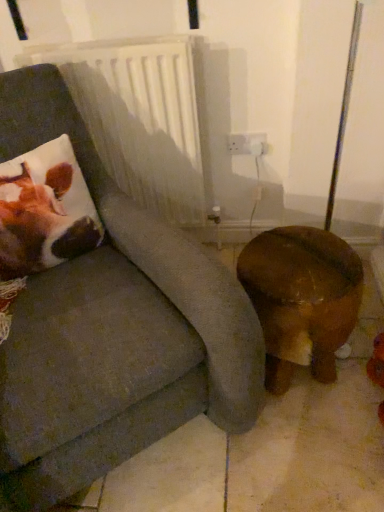
What do you see at coordinates (301, 298) in the screenshot? I see `brown wooden stool at lower right` at bounding box center [301, 298].

The image size is (384, 512). What are the coordinates of `brown wooden stool at lower right` in the screenshot? It's located at (301, 298).

Measure the distance between brown plush cushion at left and camera.

brown plush cushion at left and camera are 3.86 feet apart.

Describe the element at coordinates (113, 329) in the screenshot. I see `suede-like gray chair at left` at that location.

The image size is (384, 512). Identify the location of brown wooden stool at lower right. (301, 298).

Looking at this image, does white plastic radiator at upper center appear on the right side of brown wooden stool at lower right?

No.

Is white plastic radiator at upper center placed right next to brown wooden stool at lower right?

white plastic radiator at upper center is not next to brown wooden stool at lower right, and they're not touching.

Would you say white plastic radiator at upper center contains brown wooden stool at lower right?

No.

From a real-world perspective, relative to brown plush cushion at left, is white plastic radiator at upper center vertically above or below?

Clearly, from a real-world perspective, white plastic radiator at upper center is below brown plush cushion at left.

Considering the positions of points (162, 96) and (20, 176), is point (162, 96) closer to camera compared to point (20, 176)?

That is False.

How distant is white plastic radiator at upper center from brown plush cushion at left?

16.01 inches.

Does white plastic radiator at upper center have a larger size compared to brown plush cushion at left?

Yes, white plastic radiator at upper center is bigger than brown plush cushion at left.

Does brown plush cushion at left have a smaller size compared to suede-like gray chair at left?

Indeed, brown plush cushion at left has a smaller size compared to suede-like gray chair at left.

From a real-world perspective, is brown plush cushion at left located beneath suede-like gray chair at left?

No, from a real-world perspective, brown plush cushion at left is not beneath suede-like gray chair at left.

Between brown plush cushion at left and suede-like gray chair at left, which one has smaller width?

Thinner between the two is brown plush cushion at left.

Consider the image. Which is more to the left, brown plush cushion at left or suede-like gray chair at left?

Positioned to the left is brown plush cushion at left.

Is suede-like gray chair at left smaller than brown plush cushion at left?

No.

How far apart are suede-like gray chair at left and brown plush cushion at left?

suede-like gray chair at left is 9.91 inches from brown plush cushion at left.

Is brown plush cushion at left a part of suede-like gray chair at left?

Yes, suede-like gray chair at left is surrounding brown plush cushion at left.

Based on the photo, is brown plush cushion at left shorter than white plastic radiator at upper center?

Correct, brown plush cushion at left is not as tall as white plastic radiator at upper center.

Which is in front, point (68, 163) or point (168, 105)?

The point (68, 163) is closer to the camera.

Is brown plush cushion at left facing away from white plastic radiator at upper center?

No, brown plush cushion at left is not facing away from white plastic radiator at upper center.

Looking at this image, would you consider brown plush cushion at left to be distant from white plastic radiator at upper center?

No, brown plush cushion at left is not far from white plastic radiator at upper center.

From the picture: From the image's perspective, between white plastic radiator at upper center and suede-like gray chair at left, who is located below?

From the image's view, suede-like gray chair at left is below.

Is white plastic radiator at upper center surrounding suede-like gray chair at left?

No, suede-like gray chair at left is not inside white plastic radiator at upper center.

The width and height of the screenshot is (384, 512). Find the location of `chair on the left of white plastic radiator at upper center`. chair on the left of white plastic radiator at upper center is located at coordinates (113, 329).

Would you say suede-like gray chair at left is part of brown wooden stool at lower right's contents?

No, suede-like gray chair at left is not surrounded by brown wooden stool at lower right.

Which of these two, brown wooden stool at lower right or suede-like gray chair at left, is thinner?

brown wooden stool at lower right is thinner.

Based on the photo, is brown wooden stool at lower right looking in the opposite direction of suede-like gray chair at left?

That's not correct — brown wooden stool at lower right is not looking away from suede-like gray chair at left.

Who is taller, brown wooden stool at lower right or suede-like gray chair at left?

Standing taller between the two is suede-like gray chair at left.

Image resolution: width=384 pixels, height=512 pixels. In order to click on radiator above the brown wooden stool at lower right (from a real-world perspective) in this screenshot , I will do `click(140, 118)`.

I want to click on radiator behind the brown plush cushion at left, so click(x=140, y=118).

Estimate the real-world distances between objects in this image. Which object is further from suede-like gray chair at left, white plastic radiator at upper center or brown plush cushion at left?

white plastic radiator at upper center is positioned further to the anchor suede-like gray chair at left.

Based on their spatial positions, is brown plush cushion at left or suede-like gray chair at left further from white plastic radiator at upper center?

suede-like gray chair at left is positioned further to the anchor white plastic radiator at upper center.

From the picture: Looking at the image, which one is located further to suede-like gray chair at left, white plastic radiator at upper center or brown wooden stool at lower right?

white plastic radiator at upper center is further to suede-like gray chair at left.

Considering their positions, is suede-like gray chair at left positioned closer to brown wooden stool at lower right than white plastic radiator at upper center?

Based on the image, suede-like gray chair at left appears to be nearer to brown wooden stool at lower right.

Considering their positions, is brown plush cushion at left positioned closer to brown wooden stool at lower right than suede-like gray chair at left?

suede-like gray chair at left.

Estimate the real-world distances between objects in this image. Which object is further from suede-like gray chair at left, brown wooden stool at lower right or white plastic radiator at upper center?

white plastic radiator at upper center lies further to suede-like gray chair at left than the other object.

Considering their positions, is brown plush cushion at left positioned closer to suede-like gray chair at left than brown wooden stool at lower right?

brown plush cushion at left.

Looking at the image, which one is located further to brown wooden stool at lower right, white plastic radiator at upper center or brown plush cushion at left?

white plastic radiator at upper center lies further to brown wooden stool at lower right than the other object.

I want to click on furniture between suede-like gray chair at left and white plastic radiator at upper center from front to back, so click(301, 298).

Where is `animal between suede-like gray chair at left and white plastic radiator at upper center in the front-back direction`? animal between suede-like gray chair at left and white plastic radiator at upper center in the front-back direction is located at coordinates (44, 216).

Where is `radiator situated between brown plush cushion at left and brown wooden stool at lower right from left to right`? The width and height of the screenshot is (384, 512). radiator situated between brown plush cushion at left and brown wooden stool at lower right from left to right is located at coordinates (140, 118).

Locate an element on the screen. The image size is (384, 512). chair between brown plush cushion at left and brown wooden stool at lower right in the horizontal direction is located at coordinates (113, 329).